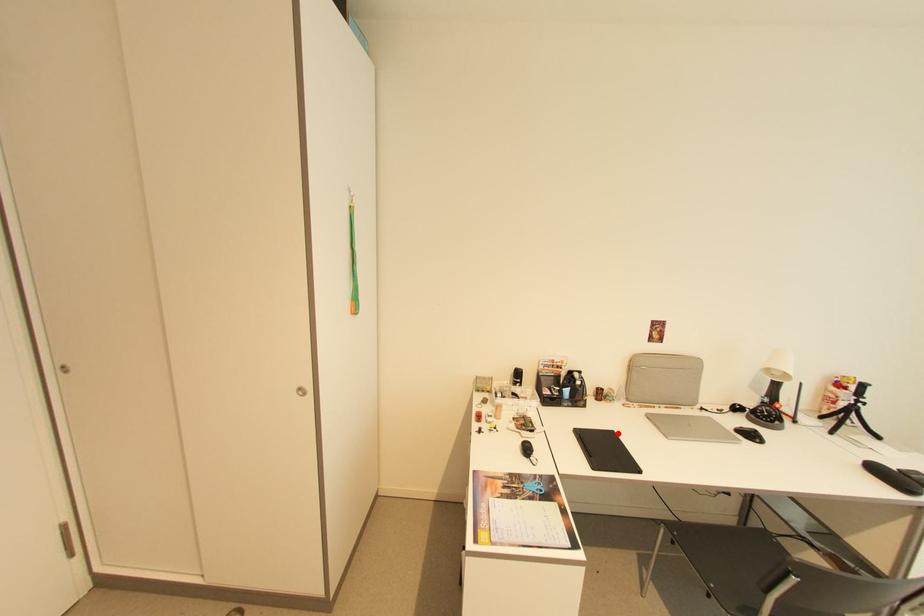
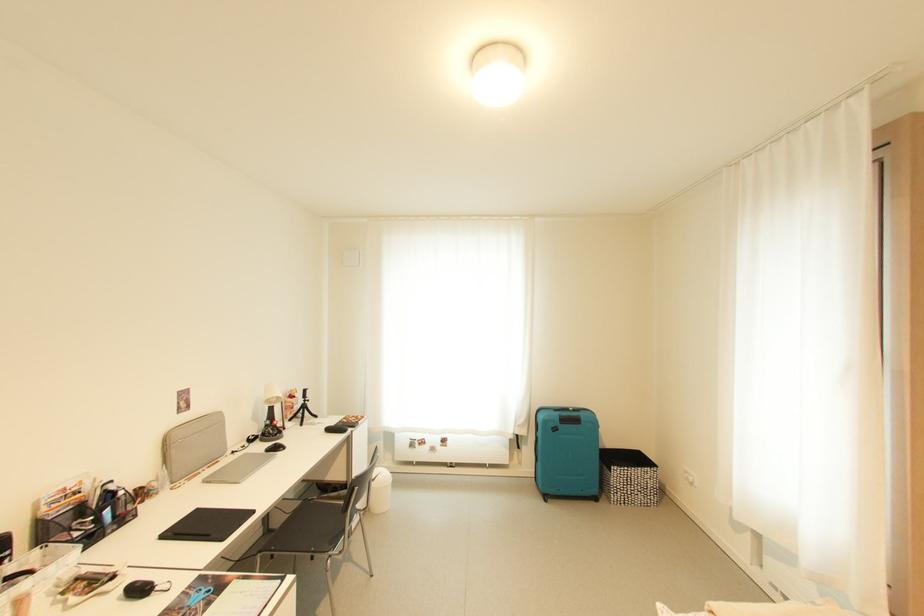
Where in the second image is the point corresponding to the highlighted location from the first image?

(202, 512)